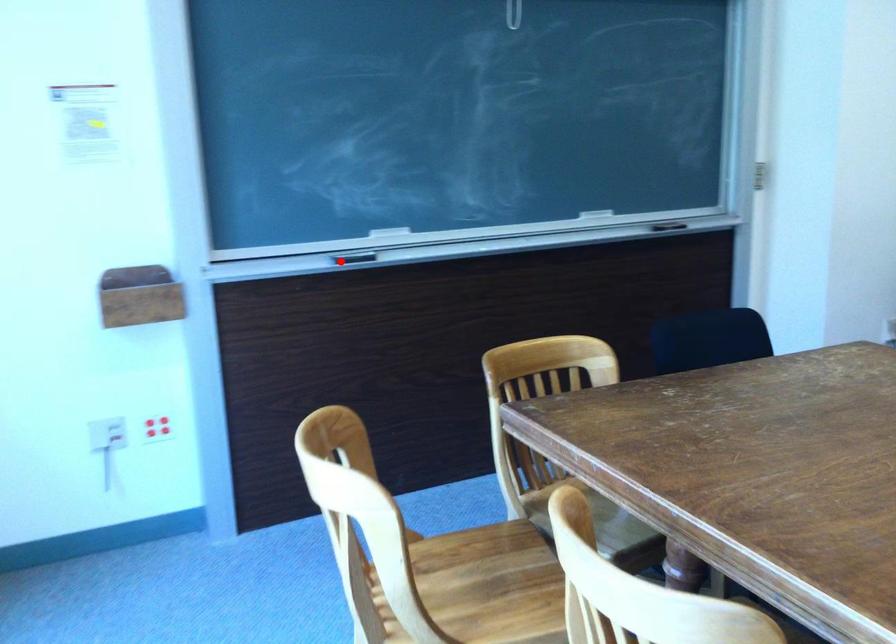
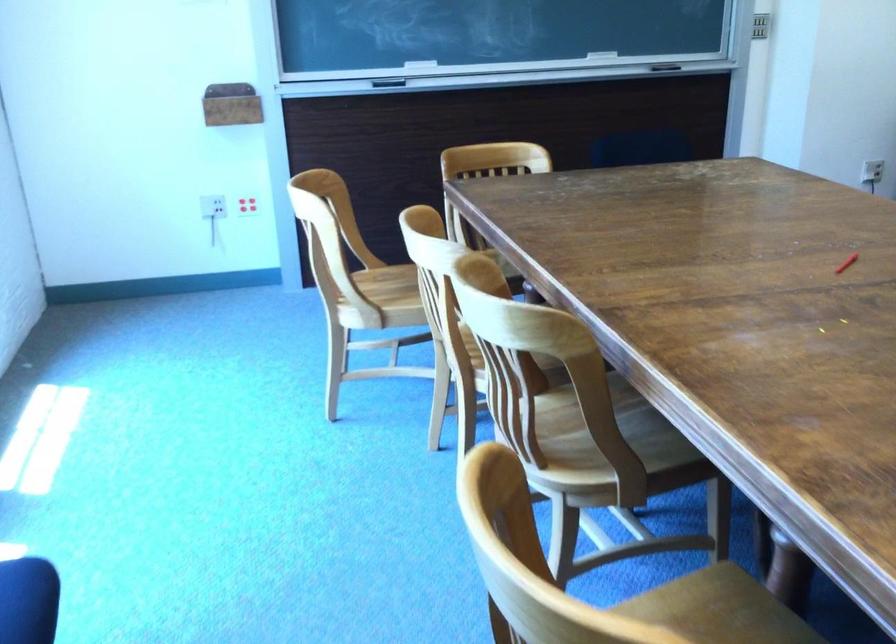
Question: A red point is marked in image1. In image2, is the corresponding 3D point closer to the camera or farther? Reply with the corresponding letter.

Choices:
 (A) The corresponding 3D point is closer.
 (B) The corresponding 3D point is farther.

Answer: (B)